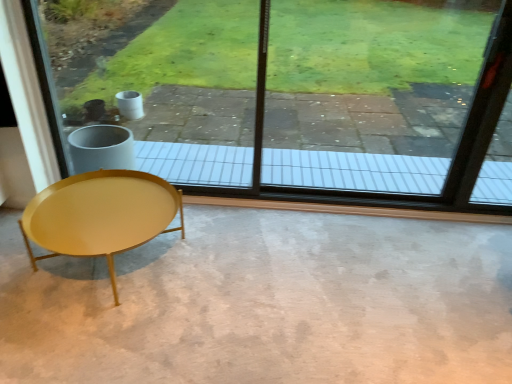
In order to click on free spot below shiny gold coffee table at lower left (from a real-world perspective) in this screenshot , I will do `click(115, 272)`.